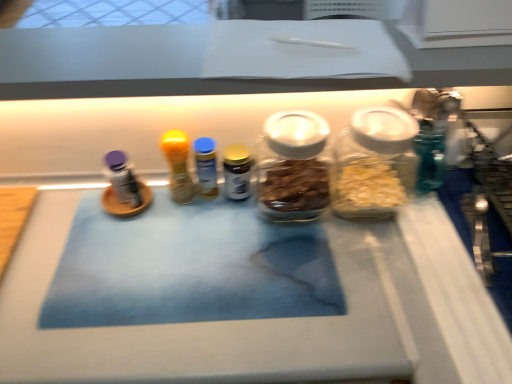
You are a GUI agent. You are given a task and a screenshot of the screen. Output one action in this format:
    pyautogui.click(x=<x>, y=<y>)
    Task: Click on the vacant position to the left of blue plastic bottle at center, which is the fourth bottle from right to left
    
    Given the screenshot: What is the action you would take?
    pyautogui.click(x=102, y=222)